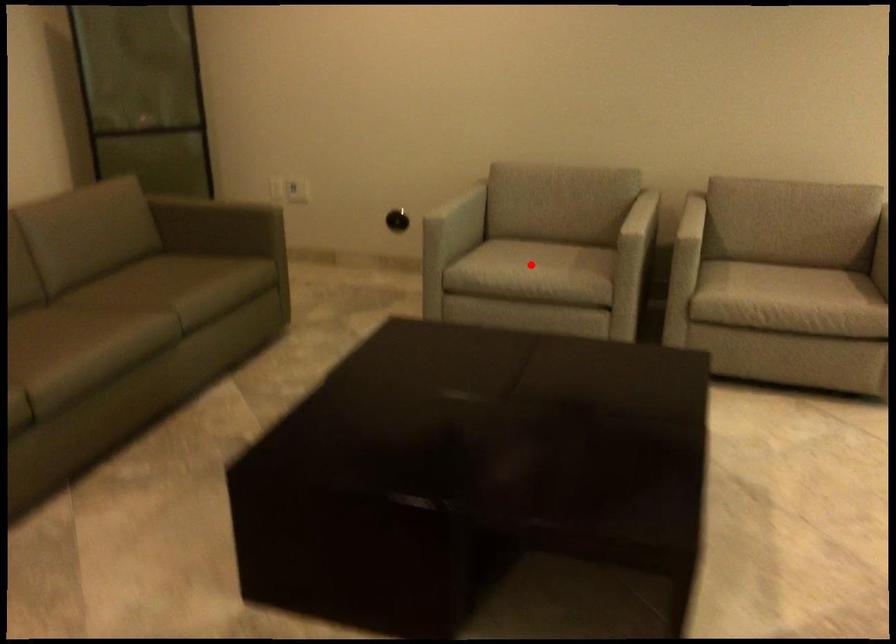
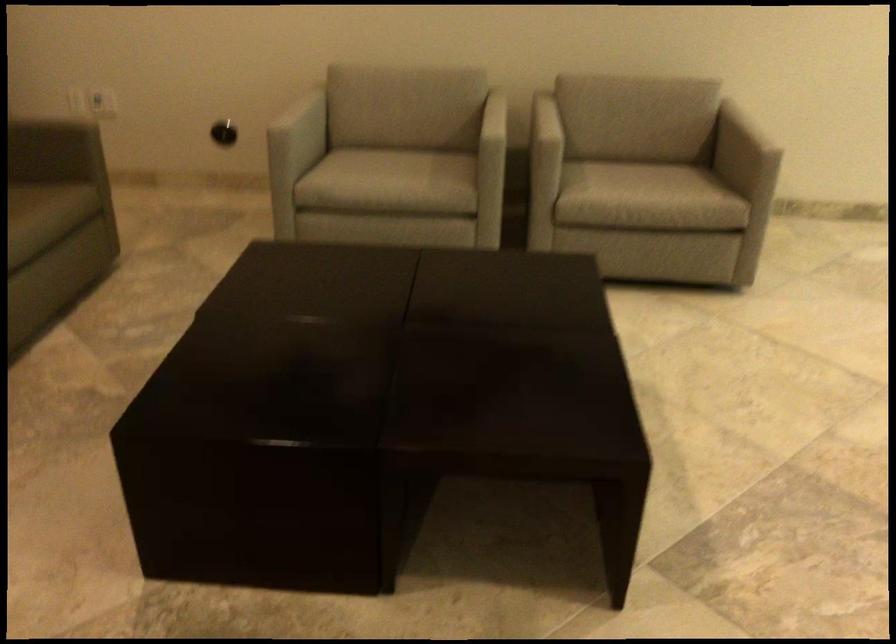
Locate, in the second image, the point that corresponds to the highlighted location in the first image.

(390, 176)